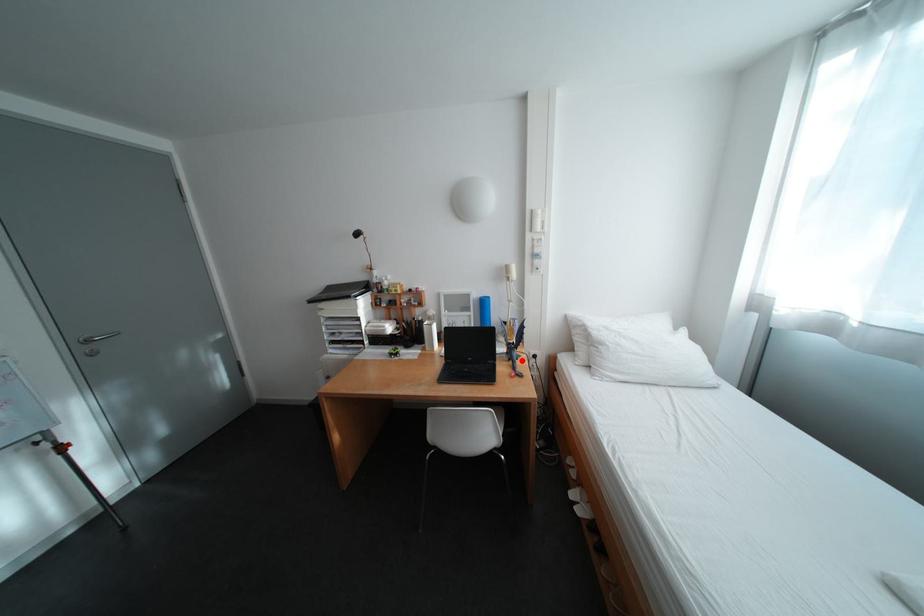
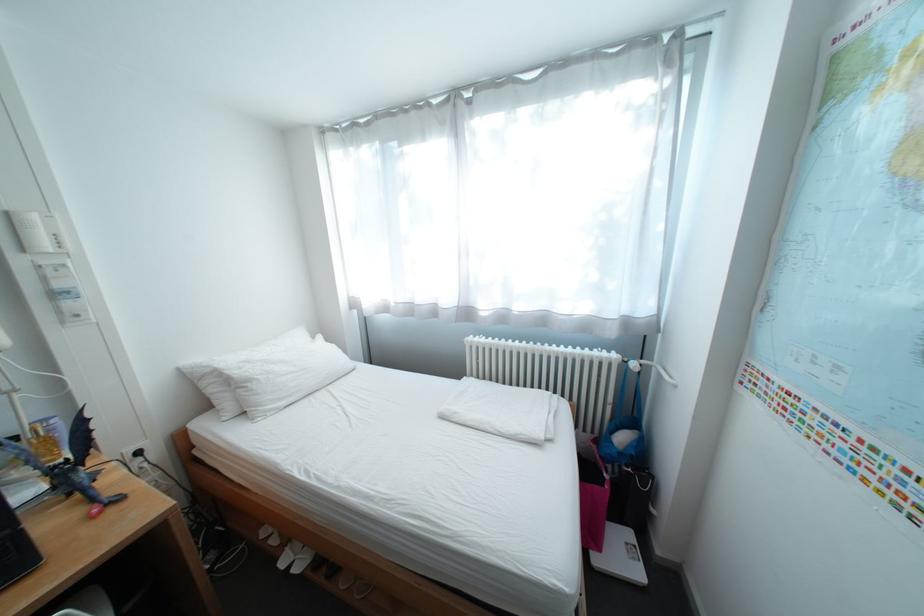
Find the pixel in the second image that matches the highlighted location in the first image.

(81, 495)